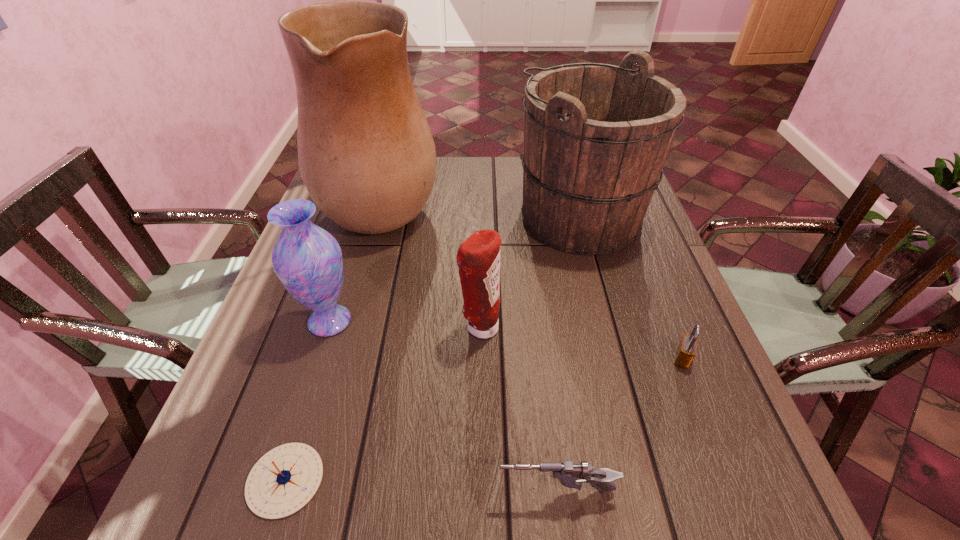
This screenshot has height=540, width=960. I want to click on cream pitcher, so click(x=366, y=154).

This screenshot has height=540, width=960. Identify the location of the sixth shortest object. (596, 136).

Find the location of a particular element. This screenshot has width=960, height=540. vase is located at coordinates (307, 259).

You are a GUI agent. You are given a task and a screenshot of the screen. Output one action in this format:
    pyautogui.click(x=<x>, y=<y>)
    Task: Click on the condiment
    
    Given the screenshot: What is the action you would take?
    pyautogui.click(x=478, y=257)

Where is `padlock`? This screenshot has width=960, height=540. padlock is located at coordinates (686, 351).

In order to click on gun in this screenshot , I will do `click(570, 475)`.

Where is `compass`? Image resolution: width=960 pixels, height=540 pixels. compass is located at coordinates (284, 480).

The width and height of the screenshot is (960, 540). In order to click on free location located 0.120m at the spout of the cream pitcher in this screenshot , I will do `click(483, 201)`.

The height and width of the screenshot is (540, 960). In order to click on vacant area located on the front of the bucket in this screenshot , I will do `click(629, 398)`.

At what (x,y) coordinates should I click in order to perform the action: click on free region located 0.330m on the front of the vase. Please return your answer as a coordinate pair (x, y). This screenshot has height=540, width=960. Looking at the image, I should click on (267, 518).